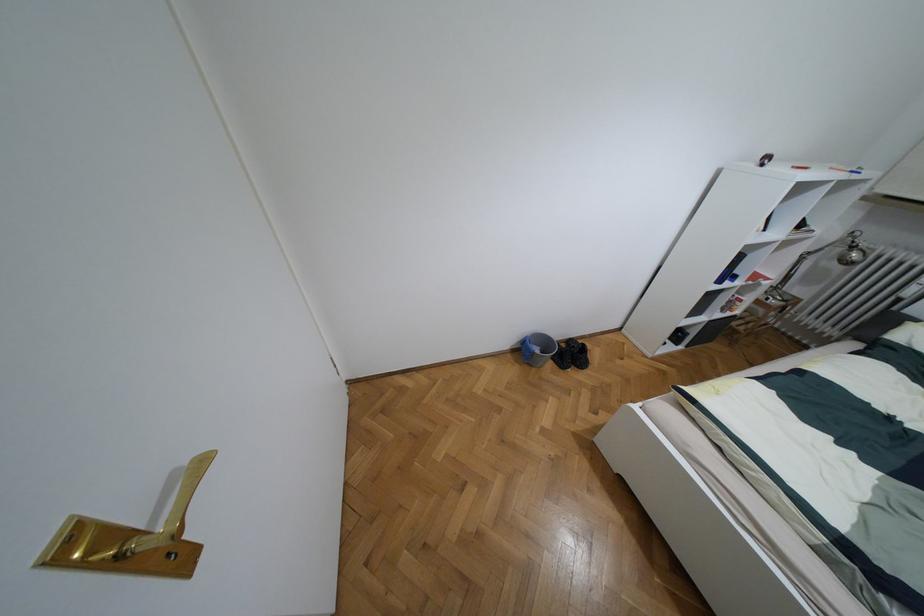
Find where to turn the gold door handle. Please return your answer as a coordinate pair (x, y).

(184, 498)